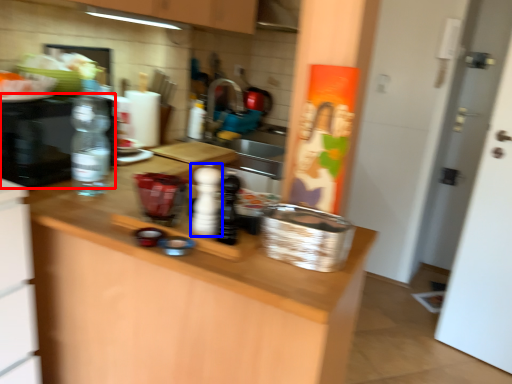
Question: Which point is further to the camera, appliance (highlighted by a red box) or bottle (highlighted by a blue box)?

Choices:
 (A) appliance
 (B) bottle

Answer: (A)